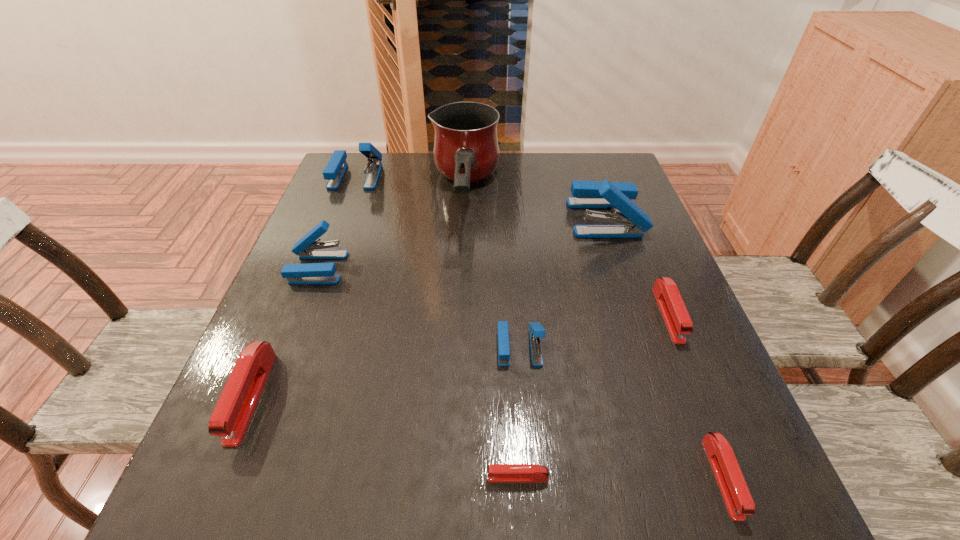
This screenshot has width=960, height=540. I want to click on vacant area situated 0.290m on the left of the smallest blue stapler, so click(x=345, y=347).

This screenshot has height=540, width=960. What are the coordinates of `vacant region located on the front-facing side of the second biggest red stapler` in the screenshot? It's located at (708, 411).

You are a GUI agent. You are given a task and a screenshot of the screen. Output one action in this format:
    pyautogui.click(x=<x>, y=<y>)
    Task: Click on the free location located 0.350m on the front-facing side of the shortest object
    
    Given the screenshot: What is the action you would take?
    pyautogui.click(x=254, y=477)

In order to click on free spot located on the front-facing side of the shortest object in this screenshot , I will do `click(300, 477)`.

I want to click on blank space located on the front-facing side of the shortest object, so (368, 477).

Locate an element on the screen. saucepan that is at the far edge is located at coordinates (466, 150).

I want to click on stapler that is at the far edge, so click(x=334, y=171).

You are a GUI agent. You are given a task and a screenshot of the screen. Output one action in this format:
    pyautogui.click(x=<x>, y=<y>)
    Task: Click on the object positioned at the far left corner
    This screenshot has height=540, width=960.
    Given the screenshot: What is the action you would take?
    click(x=334, y=171)

Locate an element on the screen. The image size is (960, 540). object at the near right corner is located at coordinates (736, 495).

The image size is (960, 540). Identify the location of vacant space at the far edge of the desktop. click(x=472, y=196).